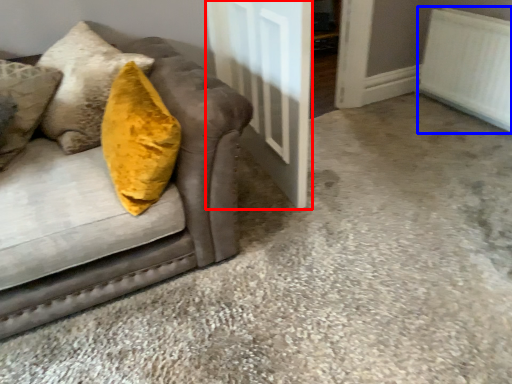
Question: Which point is further to the camera, door (highlighted by a red box) or radiator (highlighted by a blue box)?

Choices:
 (A) door
 (B) radiator

Answer: (B)